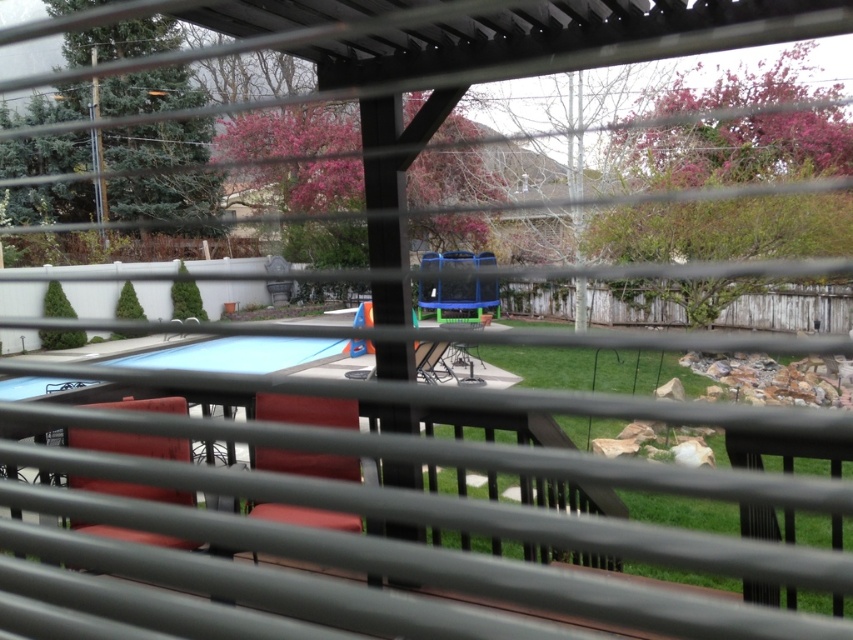
Question: Can you confirm if velvet red chair at center is smaller than metallic silver table at center?

Choices:
 (A) yes
 (B) no

Answer: (A)

Question: Is velvet red chair at center wider than velvet red chair at left?

Choices:
 (A) no
 (B) yes

Answer: (A)

Question: Can you confirm if velvet red chair at center is positioned below metallic silver table at center?

Choices:
 (A) yes
 (B) no

Answer: (A)

Question: Among these points, which one is farthest from the camera?

Choices:
 (A) 163,545
 (B) 468,326
 (C) 300,404

Answer: (B)

Question: Among these objects, which one is nearest to the camera?

Choices:
 (A) velvet red chair at center
 (B) velvet red chair at left

Answer: (B)

Question: Which object is positioned farthest from the metallic silver table at center?

Choices:
 (A) velvet red chair at left
 (B) velvet red chair at center

Answer: (A)